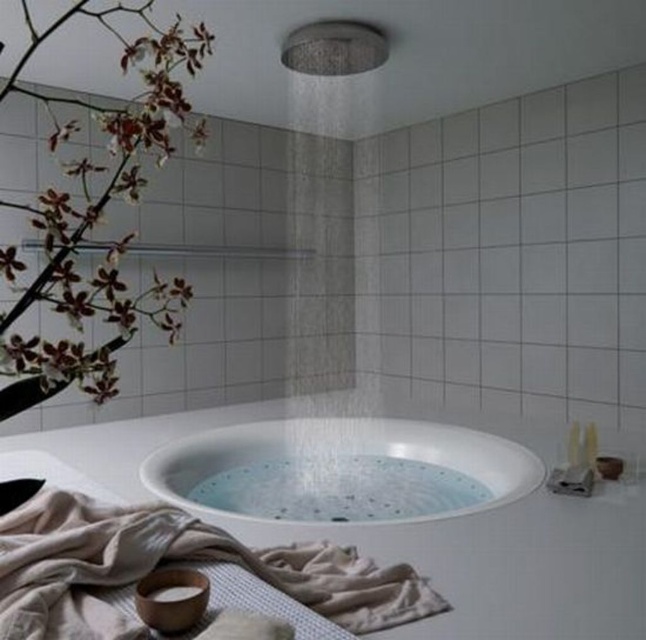
You are a photographer setting up a shoot in this bathroom. You want to capture the white matte orchid at upper left and the matte silver shower head at upper center in the same frame. Based on their positions, will the shower head appear above or below the orchid in the photo?

The white matte orchid at upper left is below the matte silver shower head at upper center, so in the photo, the shower head will appear above the orchid.

You are standing in the bathroom and see the white glossy bathtub at center and the white matte orchid at upper left. Which object is positioned to the right of the other?

The white glossy bathtub at center is to the right of the white matte orchid at upper left.

You are a designer planning to install a new light fixture in the bathroom. The fixture requires a mounting point at coordinates approximately between 0.3 and 0.2. Will the white matte orchid at upper left interfere with the installation?

The white matte orchid at upper left is positioned at point [99,218], which is close to the desired coordinates of 0.3 and 0.2. There may be potential interference, so careful planning is needed to ensure the light fixture does not disrupt the orchid or its placement.